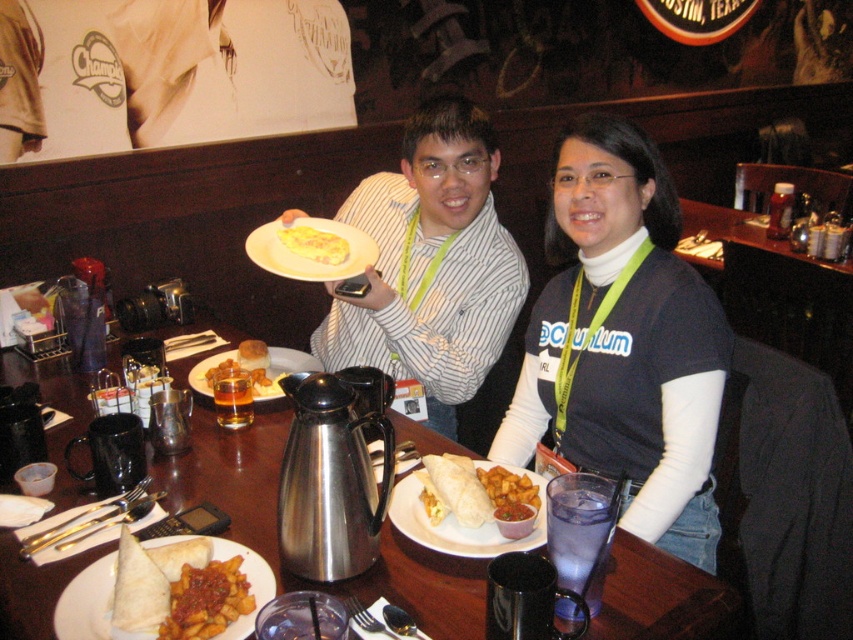
Find the location of `golden crispy fries at center`. golden crispy fries at center is located at coordinates (206, 600).

Is golden crispy fries at center further to the viewer compared to white matte plate at center?

No, it is in front of white matte plate at center.

Who is more distant from viewer, (210, 632) or (281, 272)?

The point (281, 272) is more distant.

Find the location of a particular element. golden crispy fries at center is located at coordinates (206, 600).

Is point (225, 358) positioned after point (260, 364)?

Yes, point (225, 358) is farther from viewer.

Which is below, matte white plate at center or yellow fried chicken at center?

matte white plate at center is lower down.

Which is behind, point (270, 394) or point (256, 342)?

The point (256, 342) is more distant.

In order to click on matte white plate at center in this screenshot , I will do `click(289, 362)`.

Is metallic silver thermos at center wider than soft tortilla wrap at center?

Yes, metallic silver thermos at center is wider than soft tortilla wrap at center.

Is metallic silver thermos at center closer to the viewer compared to soft tortilla wrap at center?

Yes, it is in front of soft tortilla wrap at center.

Is point (465, 612) closer to camera compared to point (425, 472)?

Yes, it is.

What are the coordinates of `metallic silver thermos at center` in the screenshot? It's located at click(x=276, y=529).